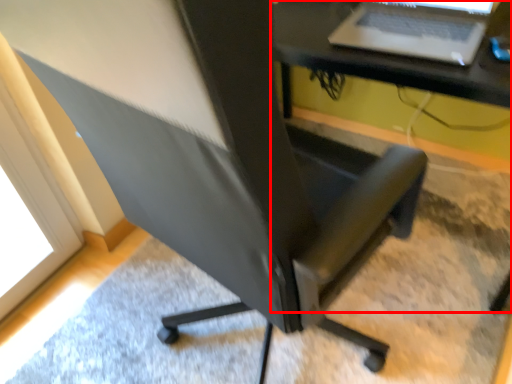
Question: From the image's perspective, where is computer desk (annotated by the red box) located in relation to laptop in the image?

Choices:
 (A) above
 (B) below

Answer: (B)